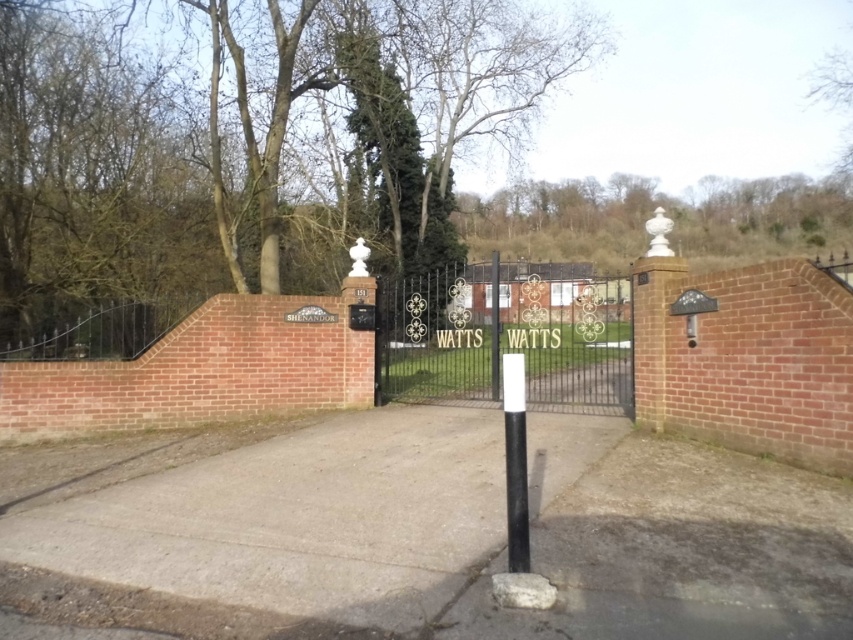
Based on the photo, you are a delivery driver approaching the driveway entrance. You need to park your vehicle without blocking the black matte pole at center. Based on its position, where should you avoid parking relative to the gate?

The black matte pole at center is located at point coordinates that place it near the front of the driveway entrance. To avoid blocking it, you should park your vehicle behind the pole or to the sides, ensuring it does not obstruct the pole.

You are a delivery driver approaching the driveway entrance. You need to park your vehicle near the black wrought iron gate at center and the black matte pole at center. Which object should you park to the left of?

You should park to the left of the black wrought iron gate at center because it is positioned on the right side of the black matte pole at center, meaning the gate is to the right of the pole. Therefore, parking to the left of the gate would place you closer to the pole.